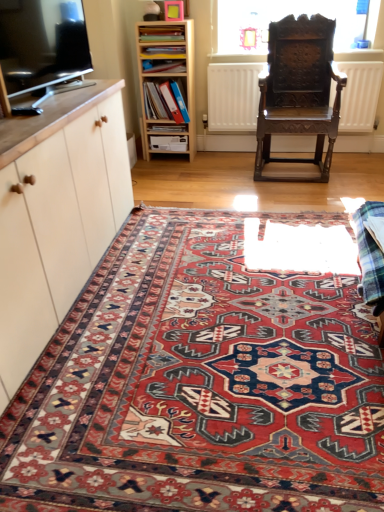
This screenshot has width=384, height=512. I want to click on vacant space in black glossy tv at upper left (from a real-world perspective), so click(76, 89).